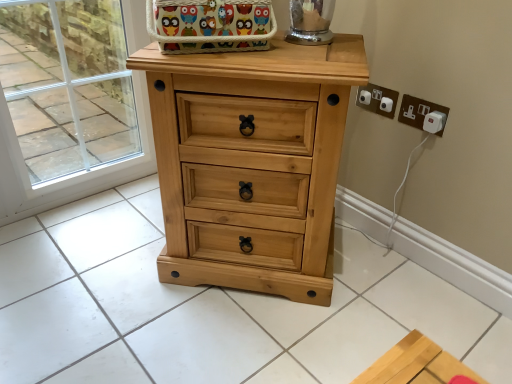
Where is `free space to the right of light wood chest of drawers at center`? free space to the right of light wood chest of drawers at center is located at coordinates (388, 283).